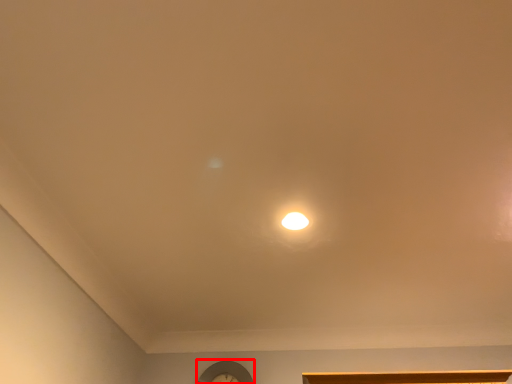
Question: From the image's perspective, what is the correct spatial positioning of clock (annotated by the red box) in reference to lamp?

Choices:
 (A) above
 (B) below

Answer: (B)